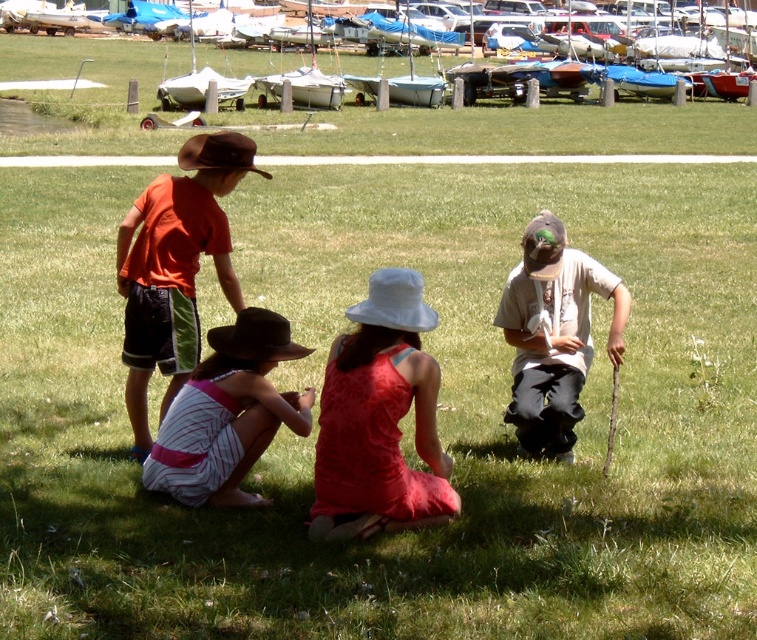
This screenshot has height=640, width=757. Describe the element at coordinates (379, 419) in the screenshot. I see `matte red dress at center` at that location.

Between matte red dress at center and orange cotton shirt at upper left, which one appears on the right side from the viewer's perspective?

Positioned to the right is matte red dress at center.

Is point (419, 374) closer to viewer compared to point (129, 385)?

Yes, point (419, 374) is closer to viewer.

You are a GUI agent. You are given a task and a screenshot of the screen. Output one action in this format:
    pyautogui.click(x=<x>, y=<y>)
    Task: Click on the matte red dress at center
    This screenshot has width=757, height=640.
    Given the screenshot: What is the action you would take?
    pyautogui.click(x=379, y=419)

Is pink striped dress at center shorter than light brown cotton shirt at lower right?

Yes, pink striped dress at center is shorter than light brown cotton shirt at lower right.

Which of these two, pink striped dress at center or light brown cotton shirt at lower right, stands taller?

With more height is light brown cotton shirt at lower right.

Between point (231, 348) and point (590, 280), which one is positioned behind?

The point (590, 280) is behind.

Find the location of a particular element. The image size is (757, 640). pink striped dress at center is located at coordinates (226, 413).

Which is below, matte red dress at center or pink striped dress at center?

pink striped dress at center is lower down.

Is point (319, 522) in front of point (270, 317)?

That is True.

The height and width of the screenshot is (640, 757). In order to click on matte red dress at center in this screenshot , I will do `click(379, 419)`.